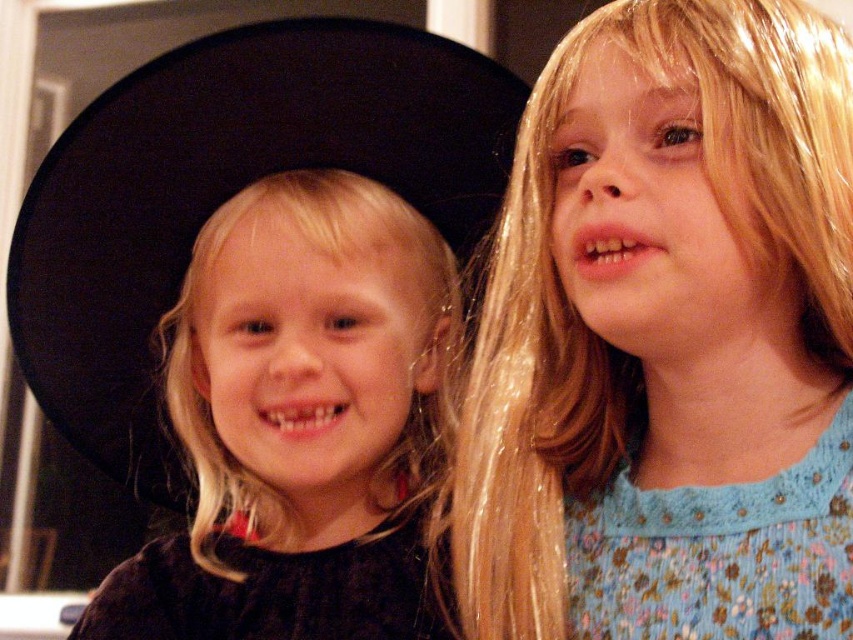
Question: Is black matte dress at center below floral blue fabric dress at right?

Choices:
 (A) no
 (B) yes

Answer: (A)

Question: Which object is farther from the camera taking this photo?

Choices:
 (A) black matte dress at center
 (B) black velvet dress at lower left
 (C) floral blue fabric dress at right
 (D) blue floral dress at upper right

Answer: (B)

Question: Can you confirm if floral blue fabric dress at right is bigger than black velvet dress at lower left?

Choices:
 (A) no
 (B) yes

Answer: (B)

Question: Where is blue floral dress at upper right located in relation to floral blue fabric dress at right in the image?

Choices:
 (A) below
 (B) above

Answer: (B)

Question: Which is nearer to the blue floral dress at upper right?

Choices:
 (A) floral blue fabric dress at right
 (B) black matte dress at center

Answer: (A)

Question: Which of these objects is positioned closest to the floral blue fabric dress at right?

Choices:
 (A) black velvet dress at lower left
 (B) black matte dress at center

Answer: (A)